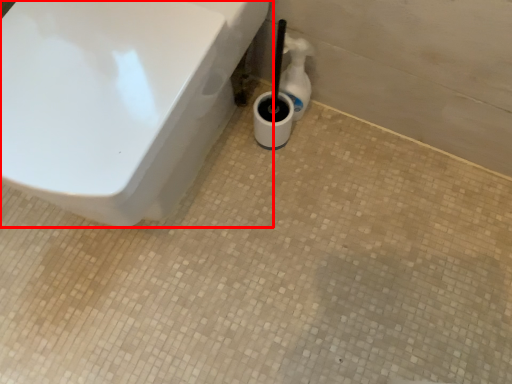
Question: From the image's perspective, what is the correct spatial positioning of toilet (annotated by the red box) in reference to bottle?

Choices:
 (A) above
 (B) below

Answer: (B)